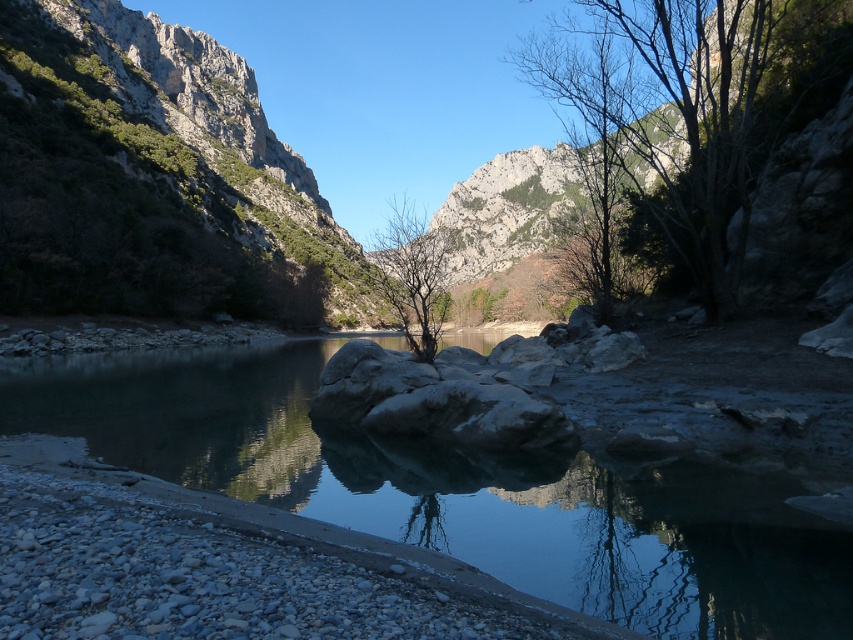
Which is more to the left, clear water at center or green leafy tree at upper right?

Positioned to the left is clear water at center.

Is point (737, 636) positioned before point (654, 172)?

Yes.

This screenshot has height=640, width=853. What are the coordinates of `clear water at center` in the screenshot? It's located at (457, 490).

Which is in front, point (641, 221) or point (422, 349)?

Positioned in front is point (422, 349).

Can you confirm if green leafy tree at upper right is wider than bare branches at center?

Indeed, green leafy tree at upper right has a greater width compared to bare branches at center.

Who is more distant from viewer, (743, 275) or (403, 326)?

Positioned behind is point (743, 275).

The width and height of the screenshot is (853, 640). Identify the location of green leafy tree at upper right. point(697,106).

Who is more distant from viewer, (816, 544) or (421, 275)?

Positioned behind is point (421, 275).

The height and width of the screenshot is (640, 853). Identify the location of clear water at center. (457, 490).

Which is in front, point (288, 410) or point (416, 292)?

Point (416, 292) is more forward.

The height and width of the screenshot is (640, 853). What are the coordinates of `clear water at center` in the screenshot? It's located at (457, 490).